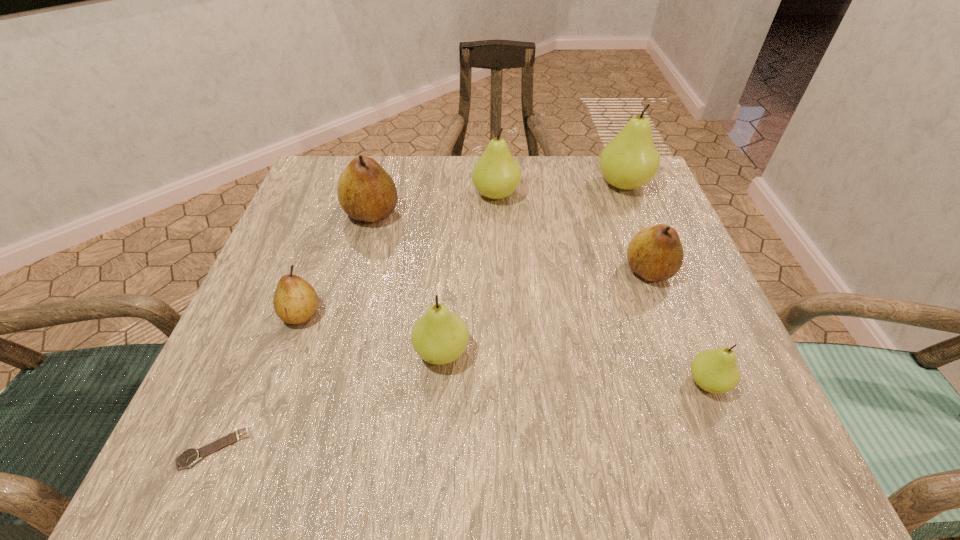
Find the location of `pear that is the fourth closest one to the fourth nearest pear`. pear that is the fourth closest one to the fourth nearest pear is located at coordinates (439, 337).

Find the location of `pear identified as the second closest to the second biggest green pear`. pear identified as the second closest to the second biggest green pear is located at coordinates (630, 160).

Locate an element on the screen. The width and height of the screenshot is (960, 540). green pear that stands as the second closest to the third smallest green pear is located at coordinates (439, 337).

Locate which green pear ranks second in proximity to the biggest brown pear. Please provide its 2D coordinates. Your answer should be formatted as a tuple, i.e. [(x, y)], where the tuple contains the x and y coordinates of a point satisfying the conditions above.

[(439, 337)]

Select which brown pear appears as the closest to the nearest object. Please provide its 2D coordinates. Your answer should be formatted as a tuple, i.e. [(x, y)], where the tuple contains the x and y coordinates of a point satisfying the conditions above.

[(295, 301)]

You are a GUI agent. You are given a task and a screenshot of the screen. Output one action in this format:
    pyautogui.click(x=<x>, y=<y>)
    Task: Click on the brown pear that is the third closest to the watch
    Image resolution: width=960 pixels, height=540 pixels.
    Given the screenshot: What is the action you would take?
    pyautogui.click(x=655, y=253)

The height and width of the screenshot is (540, 960). Identify the location of vacant region that satisfies the following two spatial constraints: 1. on the front side of the smallest green pear; 2. on the left side of the third smallest green pear. (504, 383).

Find the location of a particular element. free space that satisfies the following two spatial constraints: 1. on the back side of the biggest brown pear; 2. on the left side of the tallest pear is located at coordinates (380, 185).

Find the location of `vacant area in the image that satisfies the following two spatial constraints: 1. on the front side of the smallest green pear; 2. on the left side of the tallest pear`. vacant area in the image that satisfies the following two spatial constraints: 1. on the front side of the smallest green pear; 2. on the left side of the tallest pear is located at coordinates (701, 383).